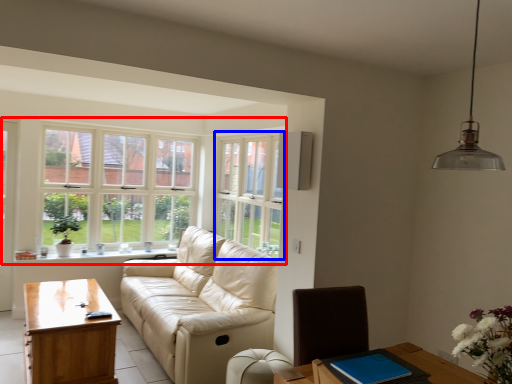
Question: Which object is further to the camera taking this photo, window (highlighted by a red box) or window (highlighted by a blue box)?

Choices:
 (A) window
 (B) window

Answer: (A)